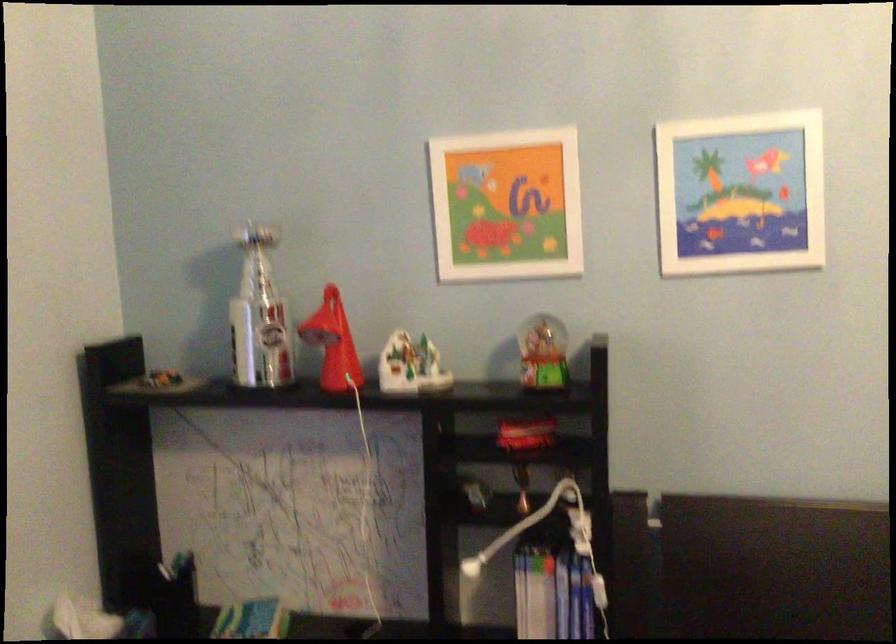
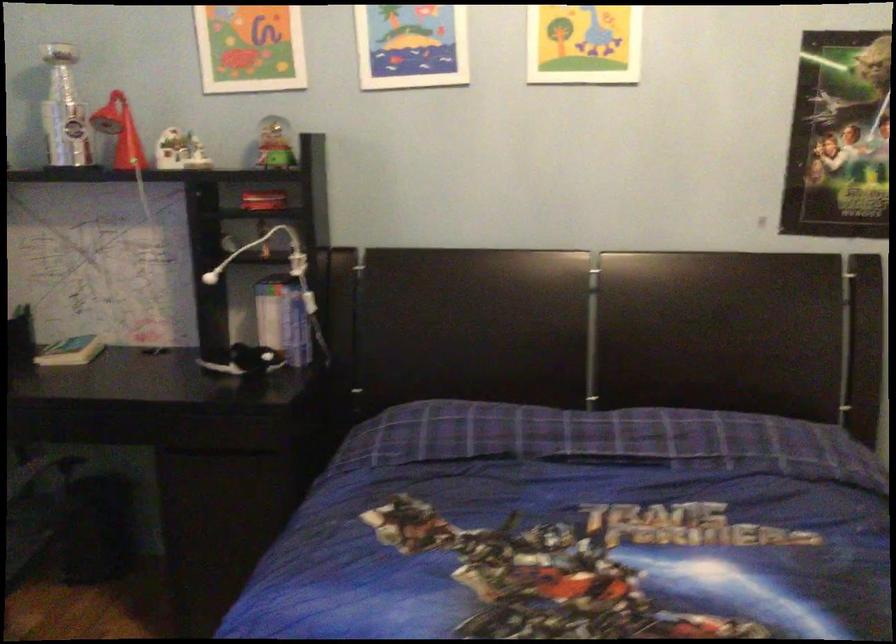
Locate, in the second image, the point that corresponds to (x=547, y=361) in the first image.

(273, 144)